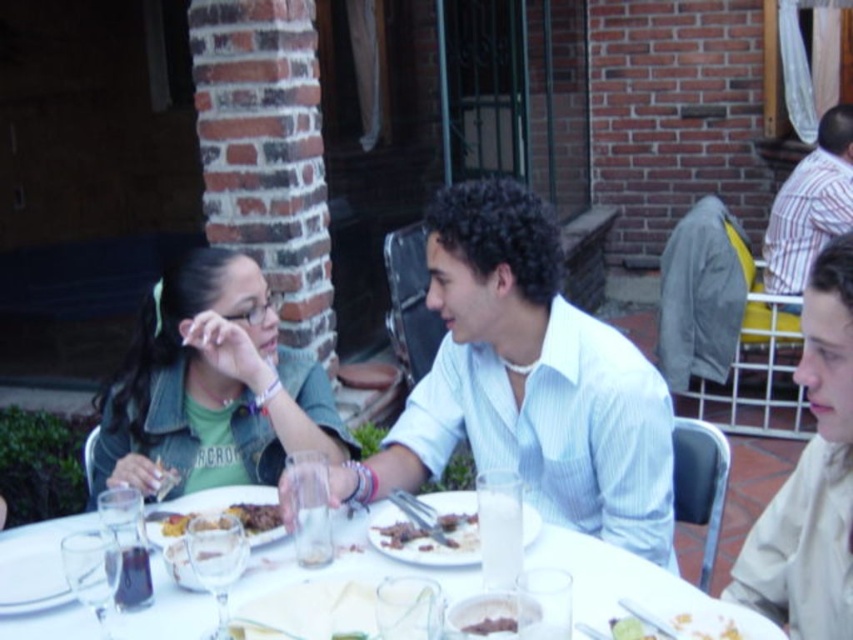
You are a waiter at this restaurant and need to place a new dessert plate on the table. Given that the white glossy table at center is larger than the yellowish matte plate at lower right, can you fit the dessert plate on the table without overlapping the existing plate?

Yes, the dessert plate can be placed on the white glossy table at center since the table is larger in size than the yellowish matte plate at lower right, providing enough space to accommodate the new plate without overlapping.

You are a server at the restaurant and need to place a new drink order on the table. Considering the height of the white glossy table at center and the striped cotton shirt at upper right, will the drink fit comfortably without being obstructed by the shirt?

The white glossy table at center is not as tall as the striped cotton shirt at upper right, so the drink might be partially obstructed by the shirt if placed on the table.

You are standing at the entrance of the restaurant and want to find the white glossy table at center. According to the coordinates provided, where should you look to locate it?

The white glossy table at center is located at coordinates point (627, 582).